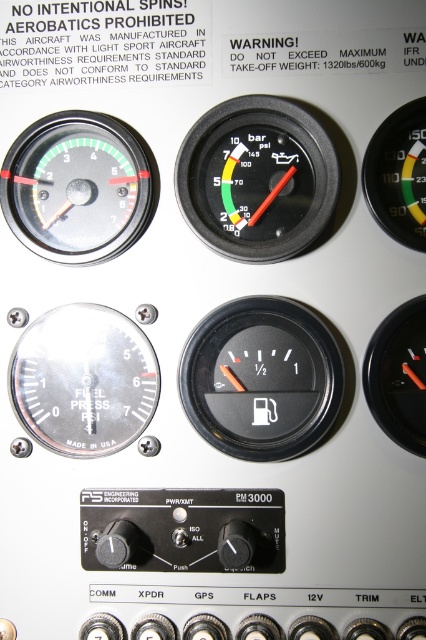
What object is located at the coordinates point (261, 378) on the aircraft control panel?

The point (261, 378) marks the black plastic fuel gauge at center.

Based on the photo, you are a pilot preparing for takeoff and notice two gauges on the aircraft control panel. The first is the matte black fuel pressure gauge at upper left, and the second is the black plastic fuel gauge at center right. Which gauge is positioned higher on the control panel?

The matte black fuel pressure gauge at upper left is positioned higher on the control panel than the black plastic fuel gauge at center right.